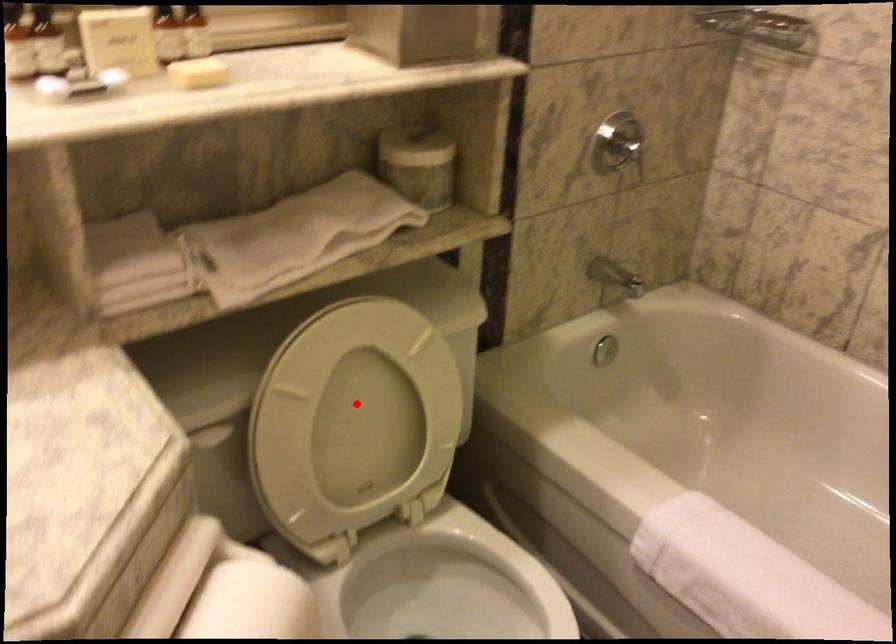
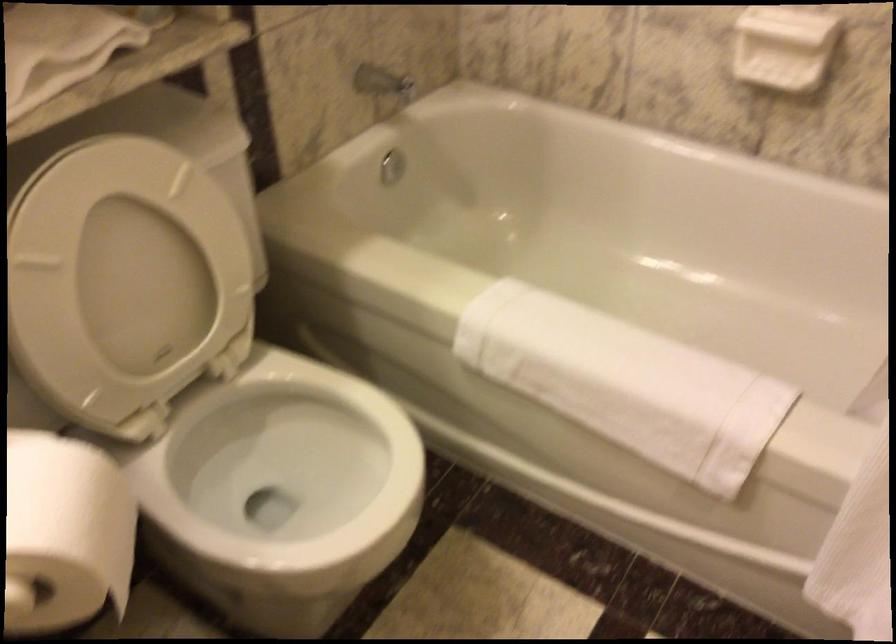
Question: I am providing you with two images of the same scene from different viewpoints. In image1, a red point is highlighted. Considering the same 3D point in image2, which of the following is correct?

Choices:
 (A) It is closer
 (B) It is farther

Answer: (A)